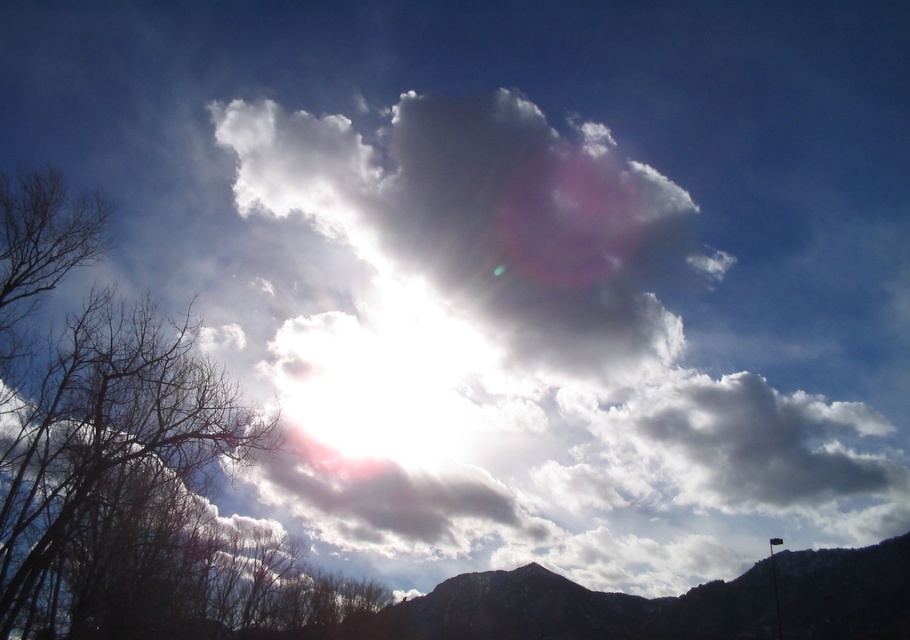
Question: Is bare branches at left positioned in front of dark gray rocky mountain at lower center?

Choices:
 (A) no
 (B) yes

Answer: (B)

Question: Which point appears farthest from the camera in this image?

Choices:
 (A) (407, 634)
 (B) (273, 595)

Answer: (A)

Question: Where is bare branches at left located in relation to dark gray rocky mountain at lower center in the image?

Choices:
 (A) left
 (B) right

Answer: (A)

Question: Among these objects, which one is farthest from the camera?

Choices:
 (A) bare branches at left
 (B) dark gray rocky mountain at lower center

Answer: (B)

Question: Where is bare branches at left located in relation to dark gray rocky mountain at lower center in the image?

Choices:
 (A) right
 (B) left

Answer: (B)